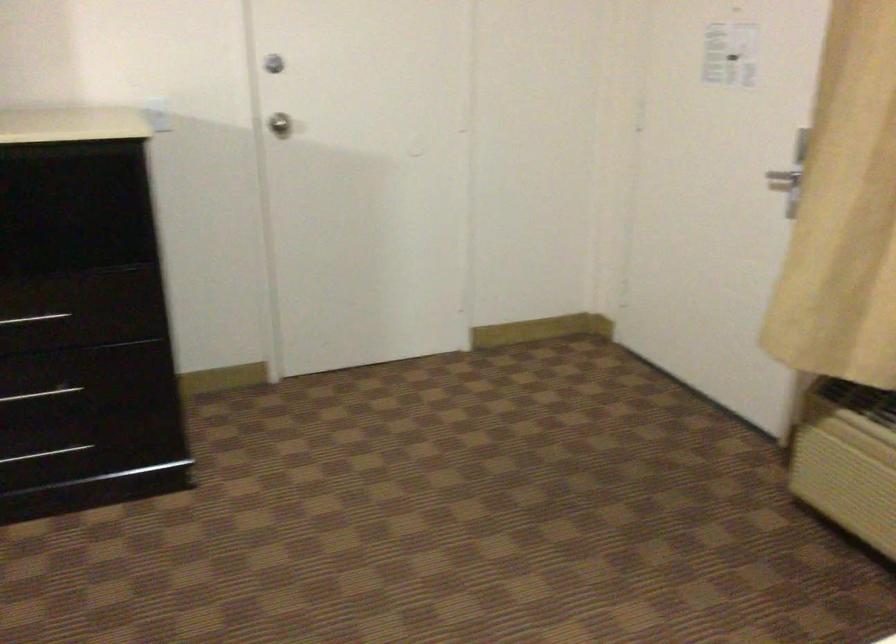
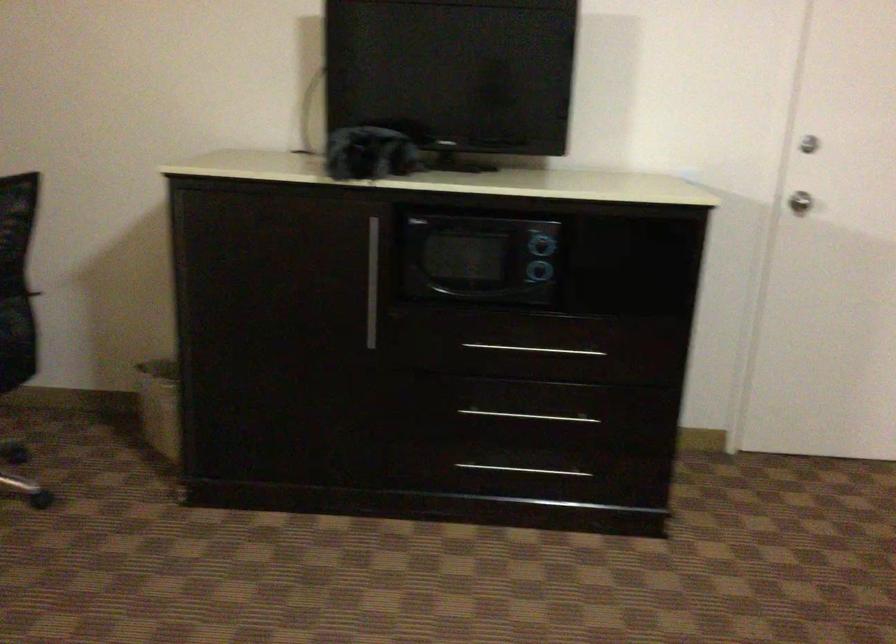
Question: The camera is either moving clockwise (left) or counter-clockwise (right) around the object. The first image is from the beginning of the video and the second image is from the end. Is the camera moving left or right when shooting the video?

Choices:
 (A) Left
 (B) Right

Answer: (B)